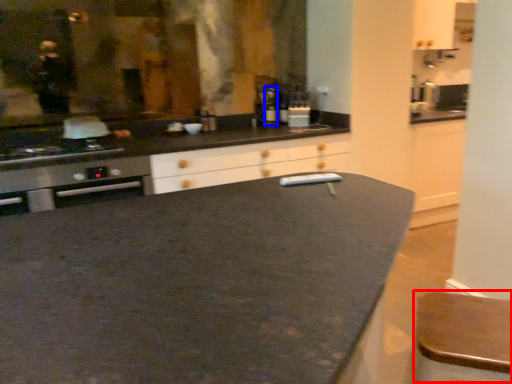
Question: Which point is further to the camera, bar stool (highlighted by a red box) or bottle (highlighted by a blue box)?

Choices:
 (A) bar stool
 (B) bottle

Answer: (B)